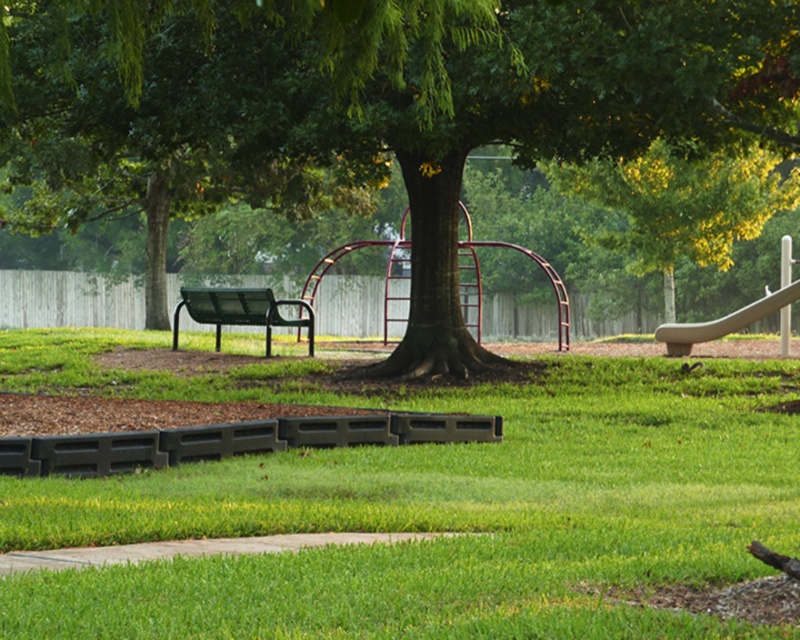
Question: Is green grass at center above green textured tree at center?

Choices:
 (A) no
 (B) yes

Answer: (A)

Question: Which of the following is the closest to the observer?

Choices:
 (A) green grass at center
 (B) green textured tree at center
 (C) green metal bench at center
 (D) smooth gray slide at right

Answer: (A)

Question: Among these points, which one is farthest from the camera?

Choices:
 (A) (274, 458)
 (B) (314, 129)
 (C) (738, 328)
 (D) (266, 333)

Answer: (D)

Question: Among these objects, which one is nearest to the camera?

Choices:
 (A) green metal bench at center
 (B) smooth gray slide at right

Answer: (A)

Question: Is green metal bench at center above smooth gray slide at right?

Choices:
 (A) no
 (B) yes

Answer: (B)

Question: In this image, where is green textured tree at center located relative to smooth gray slide at right?

Choices:
 (A) left
 (B) right

Answer: (A)